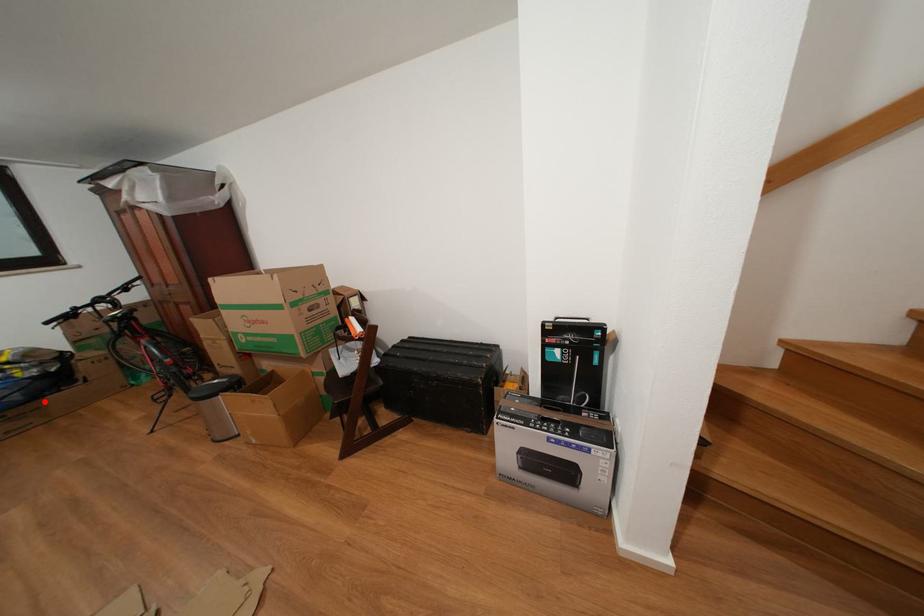
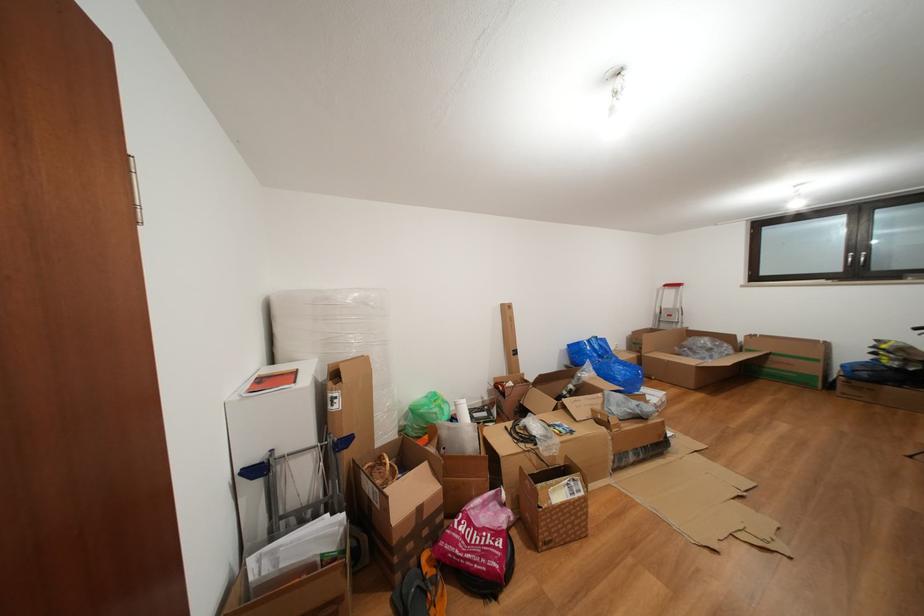
Locate, in the second image, the point that corresponds to the highlighted location in the first image.

(886, 387)